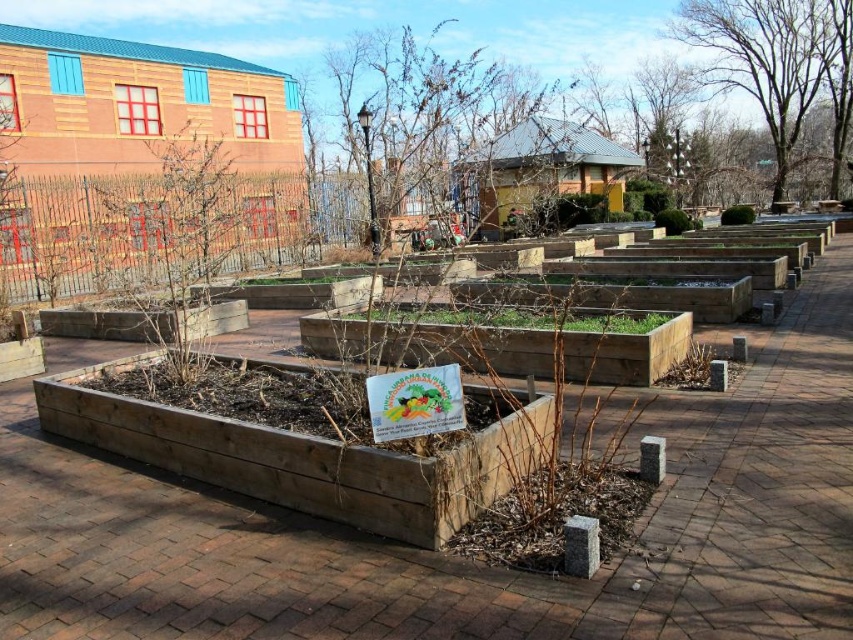
Question: In this image, where is brown wooden flower bed at center located relative to bare branches at upper right?

Choices:
 (A) below
 (B) above

Answer: (A)

Question: Is natural wood planter at center below brown wooden flower bed at center?

Choices:
 (A) yes
 (B) no

Answer: (A)

Question: Which point is closer to the camera?

Choices:
 (A) tap(259, 483)
 (B) tap(392, 321)
 (C) tap(788, 150)

Answer: (A)

Question: Among these points, which one is farthest from the camera?

Choices:
 (A) (642, 365)
 (B) (805, 86)

Answer: (B)

Question: Which point appears farthest from the camera in this image?

Choices:
 (A) (517, 339)
 (B) (299, 506)

Answer: (A)

Question: Does brown wooden flower bed at center appear on the right side of bare branches at upper right?

Choices:
 (A) no
 (B) yes

Answer: (A)